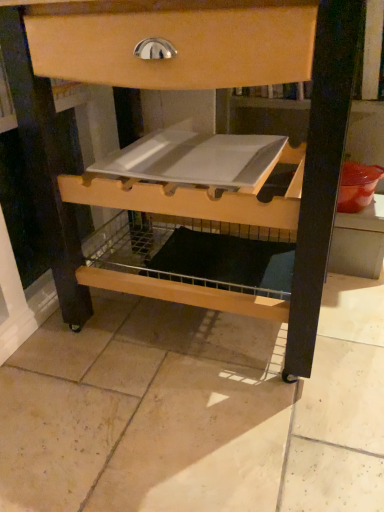
Where is `matte white tray at center`? This screenshot has height=512, width=384. matte white tray at center is located at coordinates (197, 184).

Describe the element at coordinates (197, 184) in the screenshot. Image resolution: width=384 pixels, height=512 pixels. I see `matte white tray at center` at that location.

Locate an element on the screen. matte white tray at center is located at coordinates (197, 184).